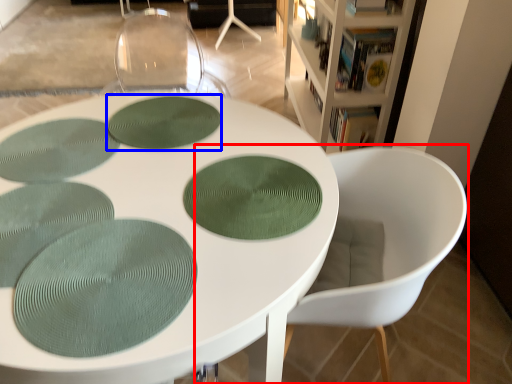
Question: Among these objects, which one is nearest to the camera, chair (highlighted by a red box) or oval (highlighted by a blue box)?

Choices:
 (A) chair
 (B) oval

Answer: (A)